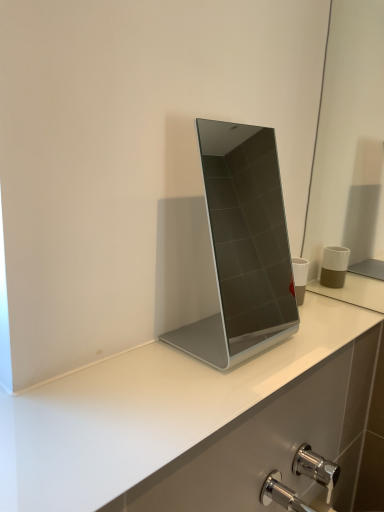
Question: Based on their positions, is chrome metallic tap at lower right located to the left or right of sleek silver laptop at center?

Choices:
 (A) left
 (B) right

Answer: (B)

Question: Is chrome metallic tap at lower right taller or shorter than sleek silver laptop at center?

Choices:
 (A) short
 (B) tall

Answer: (A)

Question: From a real-world perspective, relative to sleek silver laptop at center, is chrome metallic tap at lower right vertically above or below?

Choices:
 (A) above
 (B) below

Answer: (B)

Question: Looking at the image, does sleek silver laptop at center seem bigger or smaller compared to chrome metallic tap at lower right?

Choices:
 (A) big
 (B) small

Answer: (A)

Question: Considering their positions, is sleek silver laptop at center located in front of or behind chrome metallic tap at lower right?

Choices:
 (A) behind
 (B) front

Answer: (B)

Question: Is sleek silver laptop at center inside or outside of chrome metallic tap at lower right?

Choices:
 (A) inside
 (B) outside

Answer: (B)

Question: In terms of width, does sleek silver laptop at center look wider or thinner when compared to chrome metallic tap at lower right?

Choices:
 (A) wide
 (B) thin

Answer: (A)